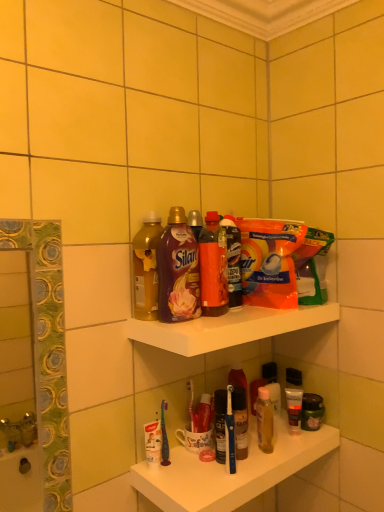
Question: Considering the relative positions of translucent orange bottle at center, the first bottle when ordered from right to left, and white plastic toothbrushes at lower center, the first shelf in the bottom-to-top sequence, in the image provided, is translucent orange bottle at center, the first bottle when ordered from right to left, to the left or to the right of white plastic toothbrushes at lower center, the first shelf in the bottom-to-top sequence,?

Choices:
 (A) left
 (B) right

Answer: (A)

Question: Is translucent orange bottle at center, the first bottle when ordered from right to left, situated inside white plastic toothbrushes at lower center, which is the second shelf in top-to-bottom order, or outside?

Choices:
 (A) inside
 (B) outside

Answer: (B)

Question: Which is nearer to the orange plastic bag at upper center, the second cleaning product in the left-to-right sequence?

Choices:
 (A) matte plastic bottle at upper center, marked as the second bottle in a left-to-right arrangement
 (B) white glossy shelf at upper center, the first shelf from the top
 (C) white plastic toothbrushes at lower center, which is the second shelf in top-to-bottom order
 (D) matte gold bottle at upper center, which ranks as the 3th bottle in right-to-left order
 (E) matte black tube at lower right

Answer: (B)

Question: Which is farther from the translucent plastic bottle at upper center, positioned as the 2th cleaning product in right-to-left order?

Choices:
 (A) matte plastic bottle at upper center, which is the 2th bottle in right-to-left order
 (B) white plastic toothbrushes at lower center, the first shelf in the bottom-to-top sequence
 (C) orange plastic bag at upper center, the second cleaning product in the left-to-right sequence
 (D) translucent orange bottle at center, which is counted as the 3th bottle, starting from the left
 (E) white glossy shelf at upper center, the first shelf from the top

Answer: (B)